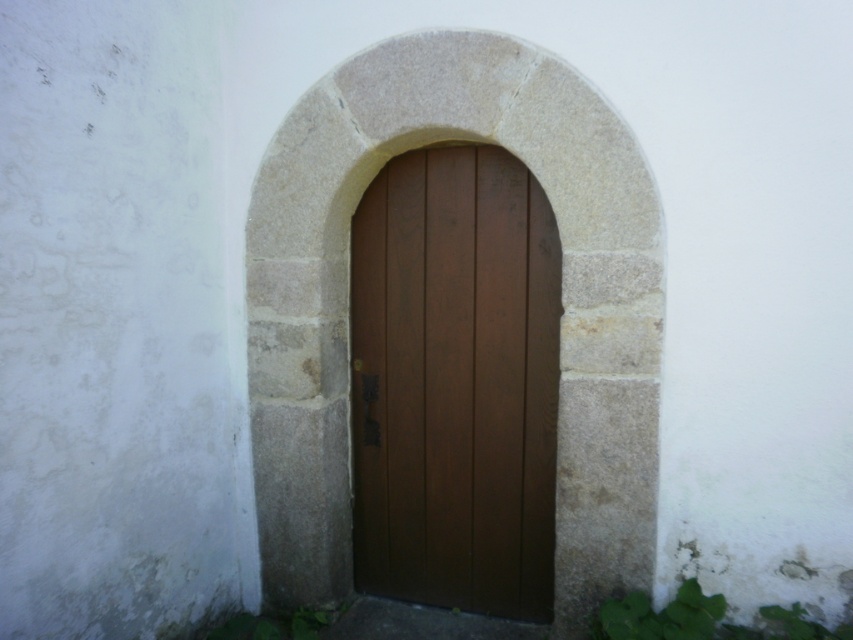
Does point (300, 369) come farther from viewer compared to point (486, 445)?

No, it is not.

This screenshot has width=853, height=640. Find the location of `smooth stone archway at center`. smooth stone archway at center is located at coordinates tap(347, 301).

I want to click on smooth stone archway at center, so click(x=347, y=301).

Find the location of a particular element. smooth stone archway at center is located at coordinates (347, 301).